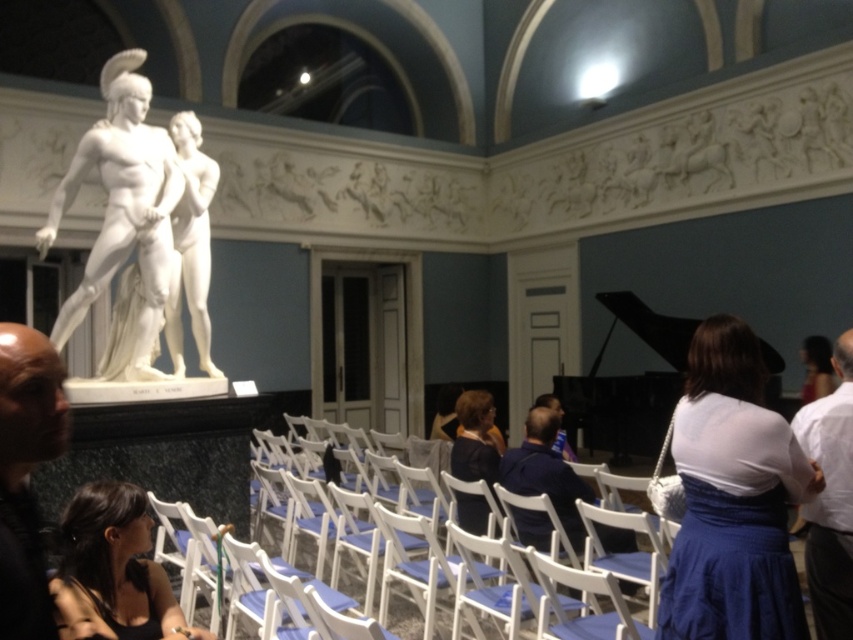
Question: Can you confirm if white fabric dress at right is bigger than bald head at left?

Choices:
 (A) no
 (B) yes

Answer: (B)

Question: Is bald head at left bigger than white cotton shirt at right?

Choices:
 (A) no
 (B) yes

Answer: (A)

Question: Which point appears farthest from the camera in this image?

Choices:
 (A) (173, 621)
 (B) (773, 502)

Answer: (A)

Question: Among these points, which one is farthest from the camera?

Choices:
 (A) (175, 609)
 (B) (49, 378)
 (C) (737, 330)

Answer: (A)

Question: Does bald head at left appear over white cotton shirt at right?

Choices:
 (A) yes
 (B) no

Answer: (A)

Question: Based on their relative distances, which object is nearer to the white marble statue at upper left?

Choices:
 (A) bald head at left
 (B) black fabric dress at lower left
 (C) white wood chair at center
 (D) white fabric dress at right

Answer: (C)